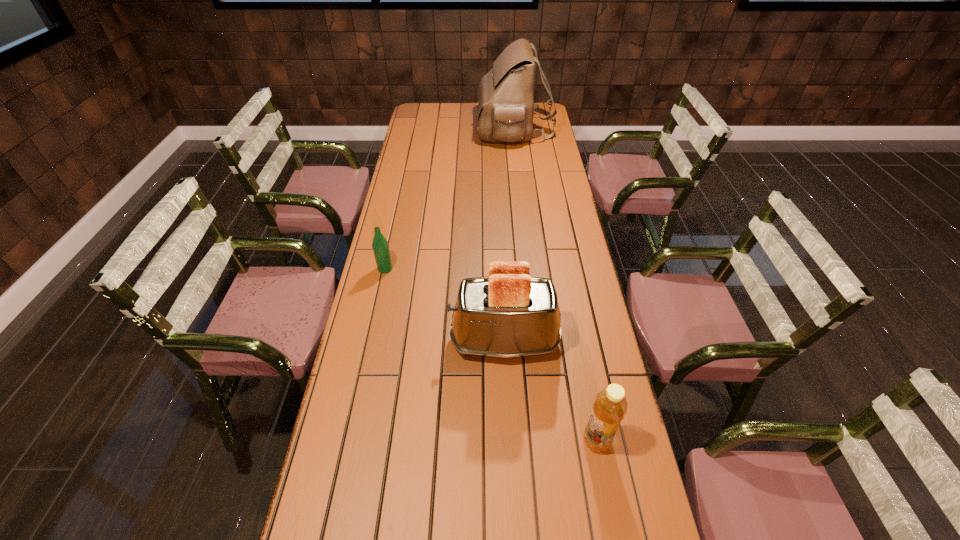
At what (x,y) coordinates should I click in order to perform the action: click on free space located 0.060m on the front flap of the farthest object. Please return your answer as a coordinate pair (x, y). Looking at the image, I should click on (465, 129).

Locate an element on the screen. free space located 0.160m on the side of the second tallest object with the control lever is located at coordinates (396, 342).

Image resolution: width=960 pixels, height=540 pixels. Find the location of `vacant area located on the side of the second tallest object with the control lever`. vacant area located on the side of the second tallest object with the control lever is located at coordinates (422, 342).

The height and width of the screenshot is (540, 960). I want to click on free location located on the side of the second tallest object with the control lever, so 358,342.

What are the coordinates of `vacant area situated on the back of the nearer bottle` in the screenshot? It's located at (571, 310).

At what (x,y) coordinates should I click in order to perform the action: click on free location located on the right of the shorter bottle. Please return your answer as a coordinate pair (x, y). The image size is (960, 540). Looking at the image, I should click on (417, 269).

Find the location of a particular element. object positioned at the far edge is located at coordinates (505, 105).

The width and height of the screenshot is (960, 540). I want to click on object that is at the left edge, so click(x=380, y=245).

I want to click on satchel at the right edge, so click(x=505, y=105).

Where is `toaster situated at the right edge`? Image resolution: width=960 pixels, height=540 pixels. toaster situated at the right edge is located at coordinates (509, 314).